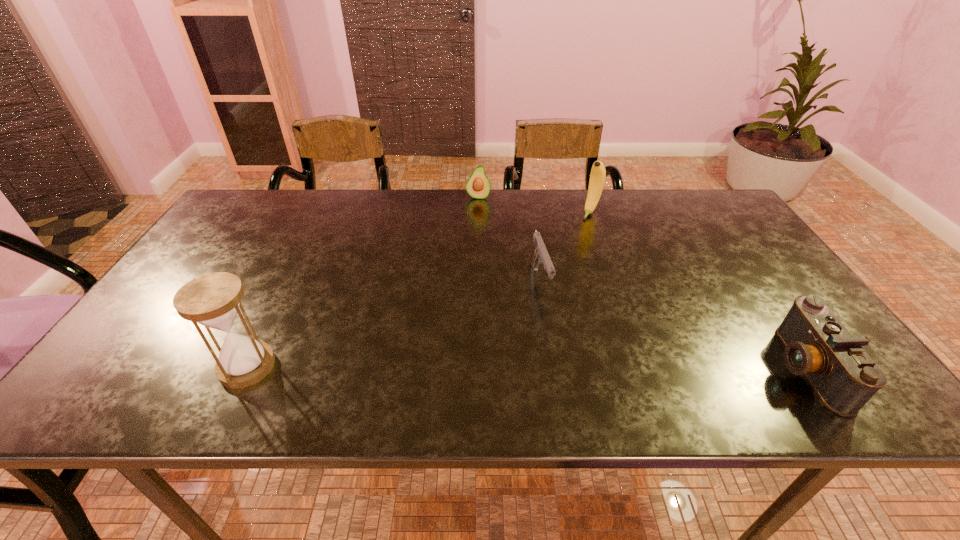
Image resolution: width=960 pixels, height=540 pixels. Identify the location of the tallest object. (213, 300).

This screenshot has height=540, width=960. In order to click on the leftmost object in this screenshot , I will do `click(213, 300)`.

Locate an element on the screen. camera is located at coordinates (817, 345).

Where is `the third object from right to left`? the third object from right to left is located at coordinates (539, 253).

This screenshot has height=540, width=960. I want to click on pistol, so click(539, 253).

This screenshot has height=540, width=960. I want to click on the fourth shortest object, so pyautogui.click(x=598, y=173).

Locate an element on the screen. banana is located at coordinates (598, 173).

Find the location of a particular element. avocado is located at coordinates (478, 185).

Locate an element on the screen. the fourth object from right to left is located at coordinates (478, 185).

Find the location of a particular element. vacant space located on the right of the leftmost object is located at coordinates (301, 366).